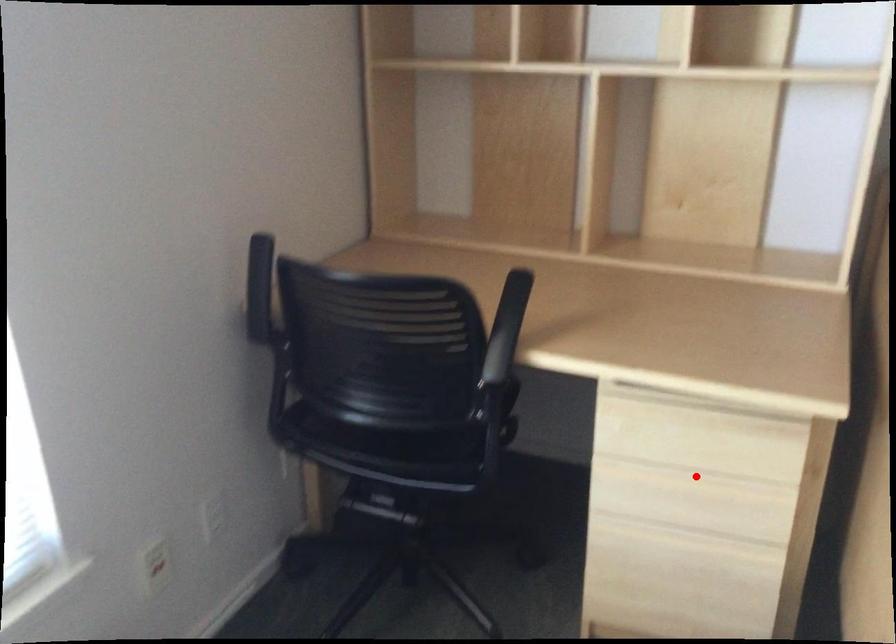
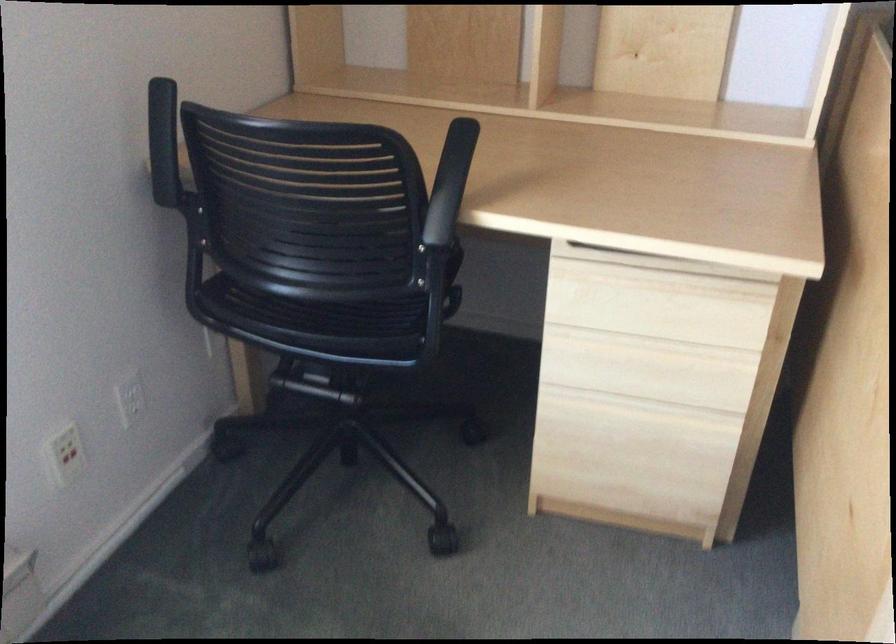
Where in the second image is the point corresponding to the highlighted location from the first image?

(652, 345)